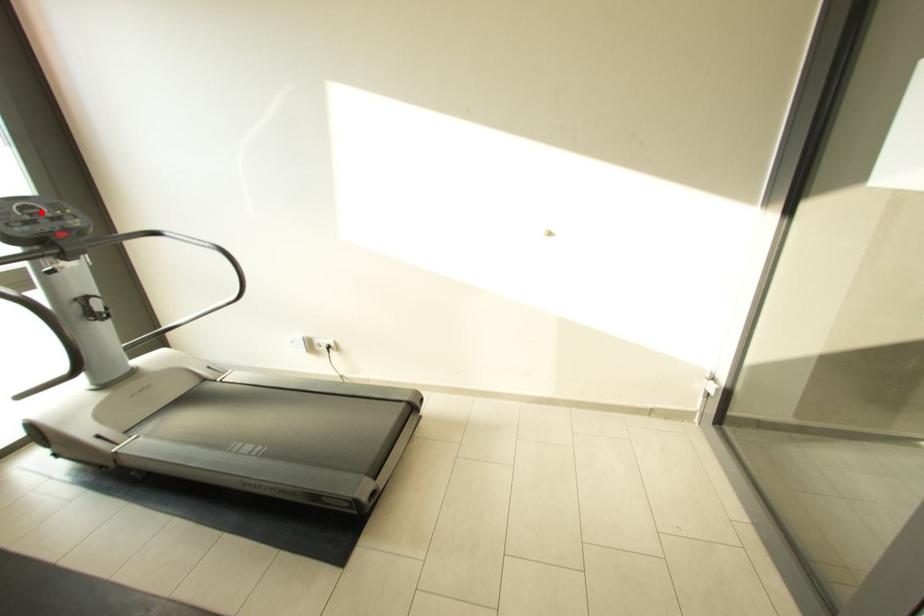
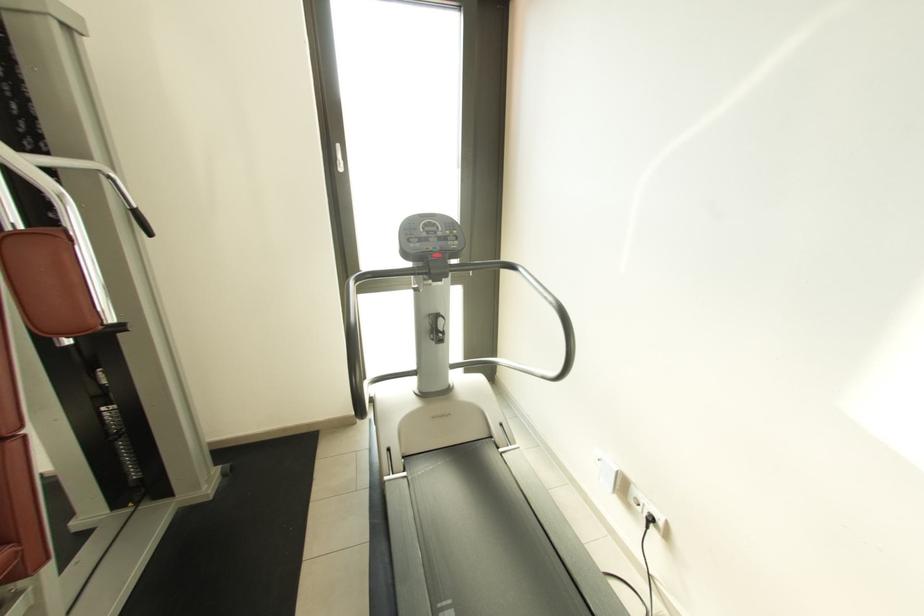
Question: I am providing you with two images of the same scene from different viewpoints. A red point is marked on the first image. At the location where the point appears in image 1, is it still visible in image 2?

Choices:
 (A) Yes
 (B) No

Answer: (A)